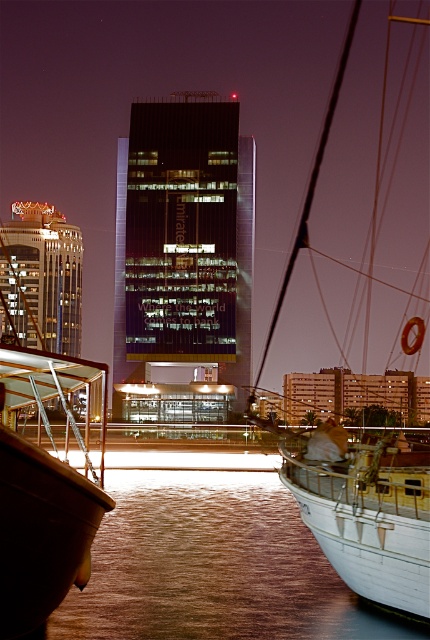
You are standing in the waterfront scene and want to take a photo. You notice two points marked in the image. Which point, point 1 at coordinates (x=362, y=612) or point 2 at (x=396, y=451), is closer to your camera lens?

Point 2 at coordinates (x=396, y=451) is closer to the camera lens because it is less further away than point 1 at (x=362, y=612).

You are a photographer standing at the waterfront. You see the brown liquid water at lower center and the white wooden boat at right. Which object is closer to the photographer?

The brown liquid water at lower center is closer to the photographer because it is located below the white wooden boat at right, meaning the boat is further away from the photographer than the water.

What is the exact 2D coordinate of the brown liquid water at lower center in the image?

The brown liquid water at lower center is located at the 2D coordinate point of (212, 566).